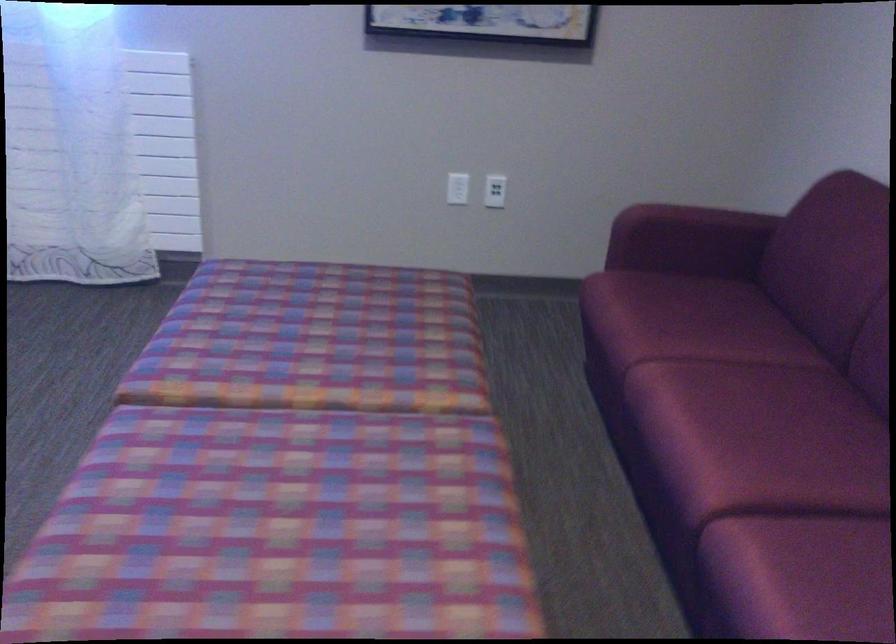
This screenshot has height=644, width=896. What do you see at coordinates (822, 256) in the screenshot? I see `the sofa armrest` at bounding box center [822, 256].